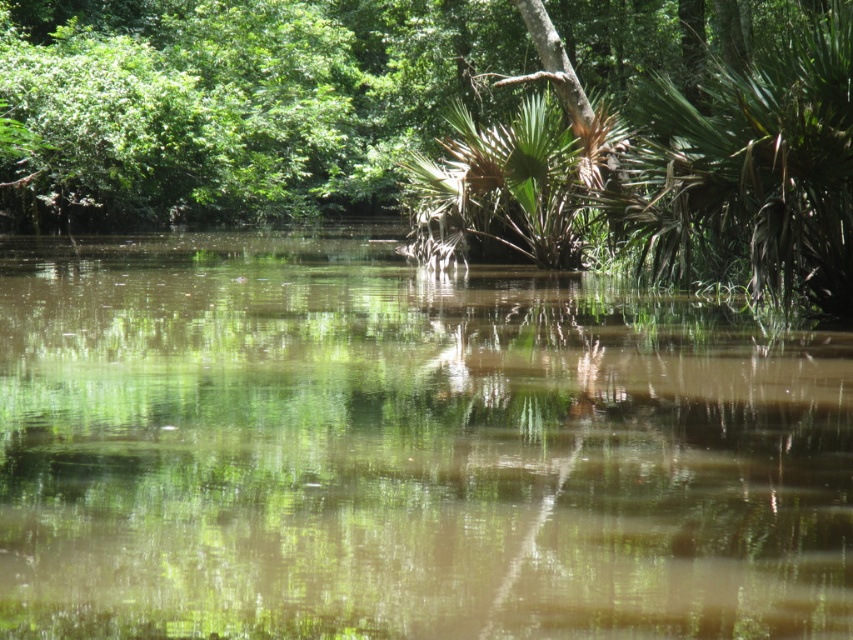
Who is more distant from viewer, (595, 472) or (805, 58)?

Point (805, 58)

Looking at this image, is green reflective water at center taller than green leafy tree at upper center?

Incorrect, green reflective water at center's height is not larger of green leafy tree at upper center's.

Where is `green reflective water at center`? The width and height of the screenshot is (853, 640). green reflective water at center is located at coordinates (403, 451).